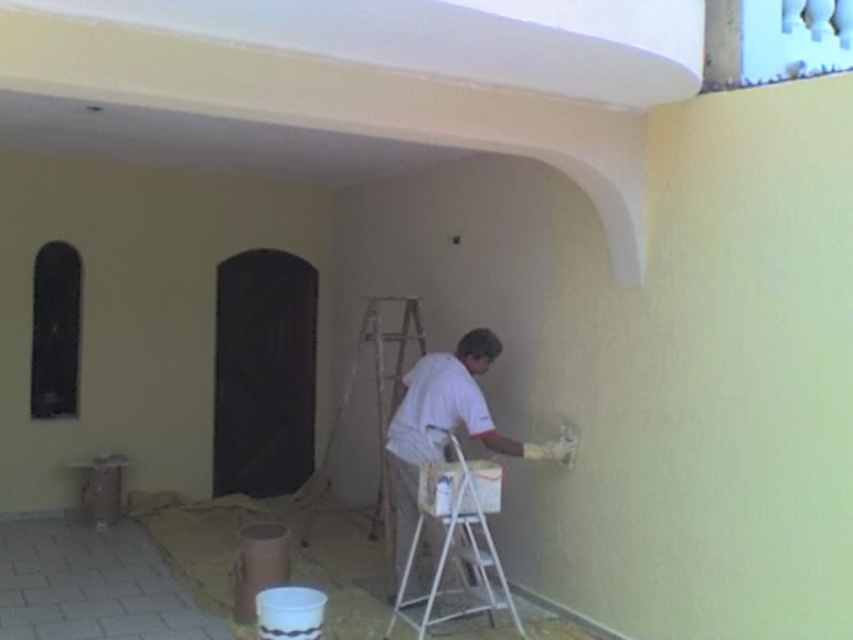
Question: Among these objects, which one is nearest to the camera?

Choices:
 (A) white matte shirt at center
 (B) white metallic ladder at center

Answer: (B)

Question: Is white metallic ladder at center above metallic silver ladder at center?

Choices:
 (A) yes
 (B) no

Answer: (B)

Question: Which is nearer to the white matte shirt at center?

Choices:
 (A) white metallic ladder at center
 (B) metallic silver ladder at center

Answer: (A)

Question: Is white matte shirt at center thinner than white metallic ladder at center?

Choices:
 (A) yes
 (B) no

Answer: (B)

Question: Based on their relative distances, which object is nearer to the white matte shirt at center?

Choices:
 (A) metallic silver ladder at center
 (B) white metallic ladder at center

Answer: (B)

Question: Does white matte shirt at center lie in front of white metallic ladder at center?

Choices:
 (A) no
 (B) yes

Answer: (A)